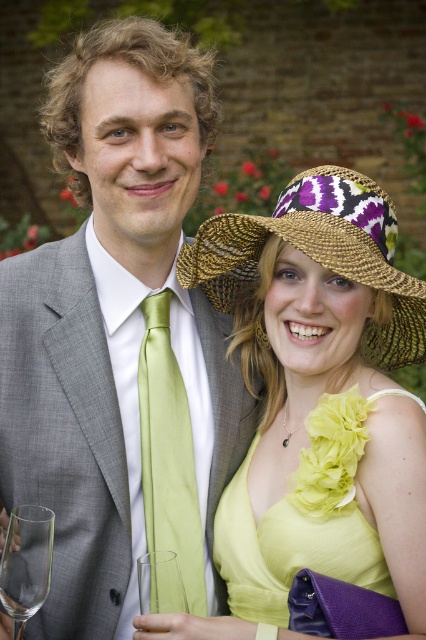
You are a photographer trying to capture the perfect shot of the two people in the image. The matte gray suit at center is located at point (120, 339). Where should you position your camera to ensure the matte gray suit at center is in focus?

The point (120, 339) marks the location of the matte gray suit at center, so you should position your camera to focus on that specific coordinate to ensure the matte gray suit at center is in focus.

You are a photographer at a formal event. You need to position the matte yellow dress at center and the satin green tie at center so that they are aligned symmetrically along the horizontal axis. Which direction should you move one of them to achieve this symmetry?

The matte yellow dress at center is to the right of the satin green tie at center. To align them symmetrically along the horizontal axis, move the matte yellow dress at center to the left or move the satin green tie at center to the right until they are equidistant from the center point.